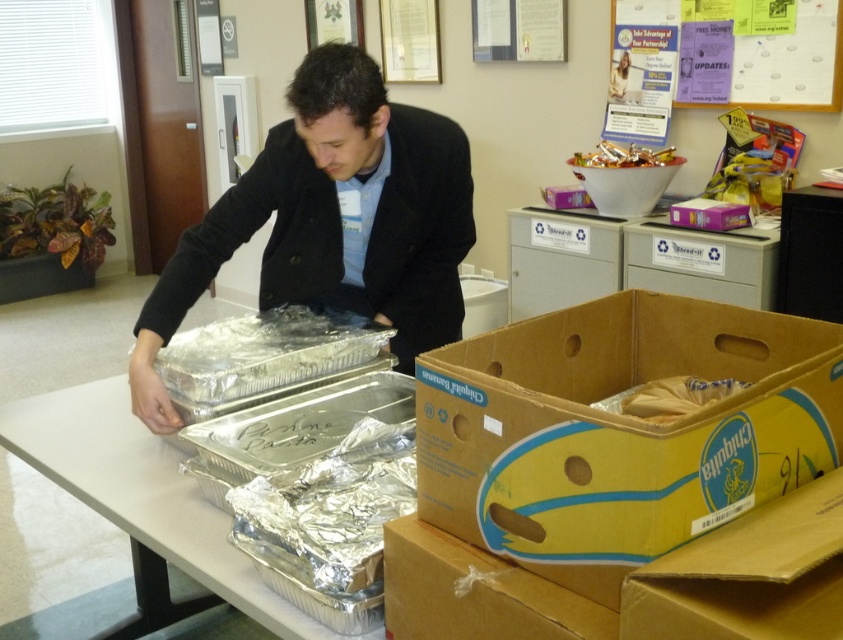
Question: Does cardboard box at lower right appear under matte black jacket at center?

Choices:
 (A) no
 (B) yes

Answer: (B)

Question: Which of the following is the closest to the observer?

Choices:
 (A) (588, 410)
 (B) (310, 266)

Answer: (A)

Question: Is the position of cardboard box at lower right less distant than that of silver aluminum trays at center?

Choices:
 (A) no
 (B) yes

Answer: (B)

Question: Among these objects, which one is farthest from the camera?

Choices:
 (A) metallic shiny candy at upper center
 (B) brown cardboard box at lower center
 (C) cardboard box at lower right
 (D) matte black jacket at center

Answer: (A)

Question: Is matte black jacket at center thinner than brown cardboard box at lower center?

Choices:
 (A) yes
 (B) no

Answer: (B)

Question: Among these points, which one is nearest to the camera?

Choices:
 (A) (772, 433)
 (B) (540, 595)

Answer: (B)